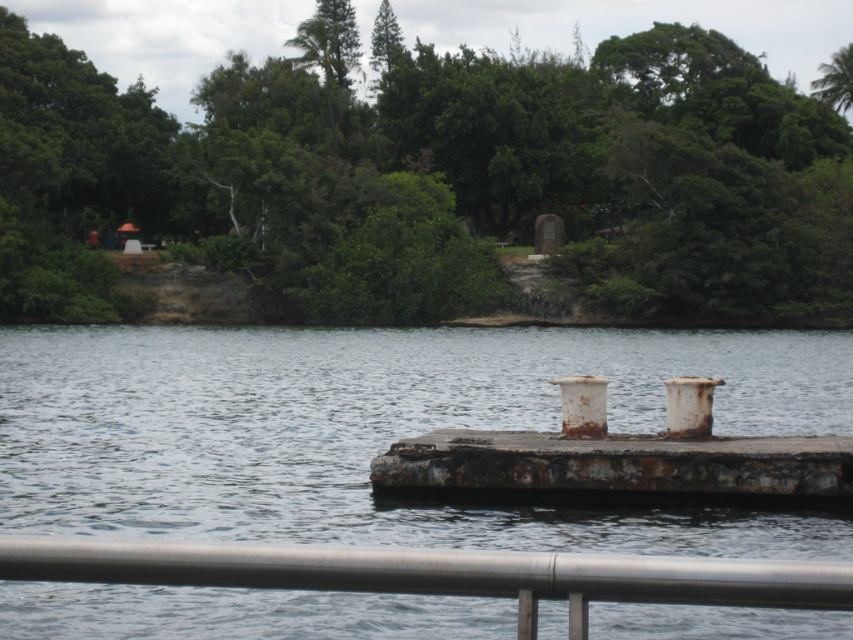
Question: In this image, where is silver metallic rail at lower center located relative to rusty metal dock at center?

Choices:
 (A) above
 (B) below

Answer: (A)

Question: In this image, where is green leafy tree at upper center located relative to silver metallic rail at lower center?

Choices:
 (A) left
 (B) right

Answer: (B)

Question: Does rusty metallic water at center come behind rusty metal dock at center?

Choices:
 (A) yes
 (B) no

Answer: (B)

Question: Which of the following is the farthest from the observer?

Choices:
 (A) (224, 451)
 (B) (341, 317)

Answer: (B)

Question: Which is farther from the green leafy tree at upper center?

Choices:
 (A) rusty metallic water at center
 (B) rusty metal dock at center

Answer: (B)

Question: Which point is farther to the camera?

Choices:
 (A) (549, 541)
 (B) (461, 461)
 (C) (177, 564)

Answer: (B)